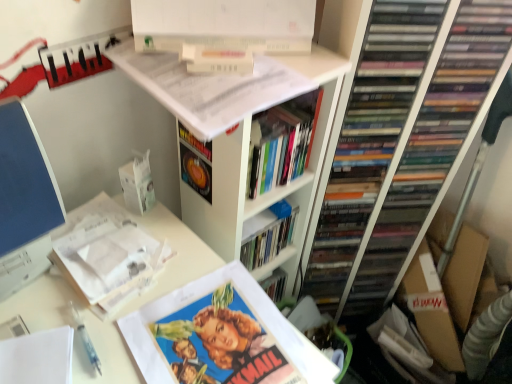
Identify the location of free space below vintage paper movie poster at center, which is the first book in bottom-to-top order (from a real-world perspective). The image size is (512, 384). (222, 342).